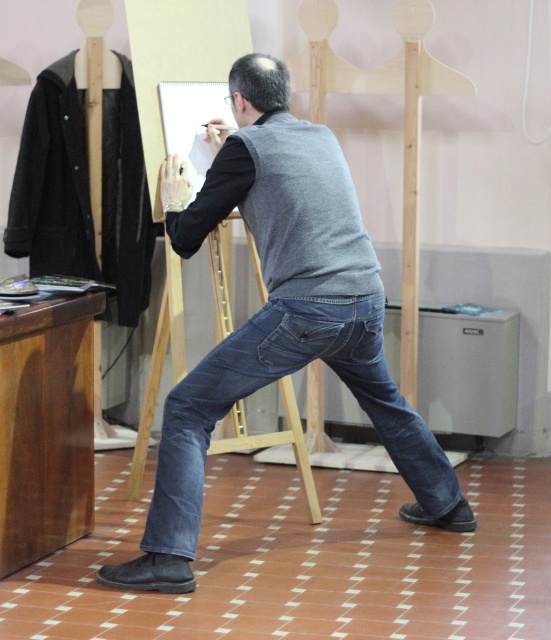
Does gray matte vest at center have a lesser width compared to denim jeans at center?

In fact, gray matte vest at center might be wider than denim jeans at center.

Between gray matte vest at center and denim jeans at center, which one is positioned higher?

gray matte vest at center is above.

The width and height of the screenshot is (551, 640). In order to click on gray matte vest at center in this screenshot , I will do `click(278, 316)`.